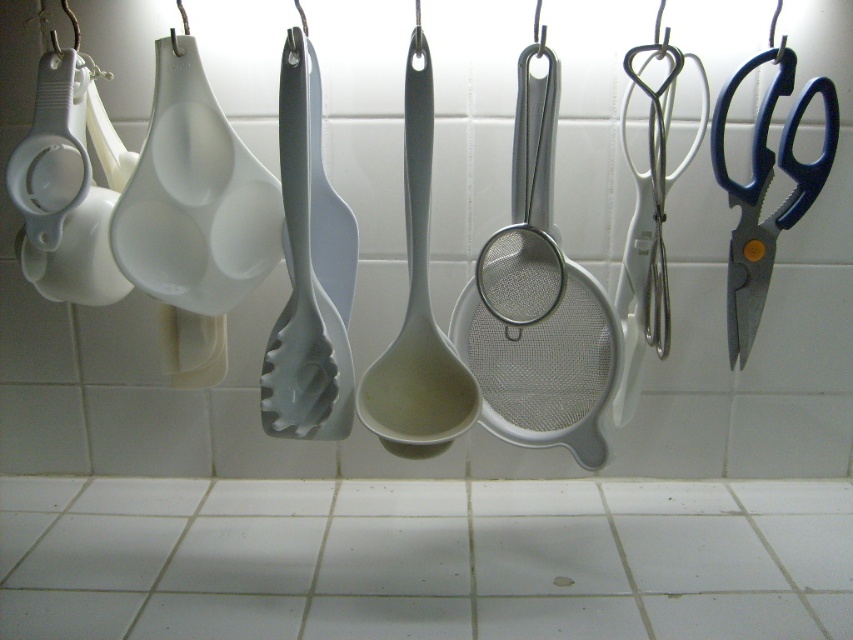
What object is located at the coordinates point [416,308]?

The gray matte ladle at center is located at point [416,308].

You are a kitchen designer who wants to hang a new utensil exactly 10 cm to the right of the gray matte pasta server at center. What coordinate would you use for this new position?

The new position would be at coordinate point 0.425 plus 0.010 equals 0.435, so the coordinate is (308, 278).

You are trying to choose between the gray matte pasta server at center and the gray matte ladle at center to store in a narrow drawer. Which one would fit better?

The gray matte pasta server at center is thinner than the gray matte ladle at center, so it would fit better in a narrow drawer.